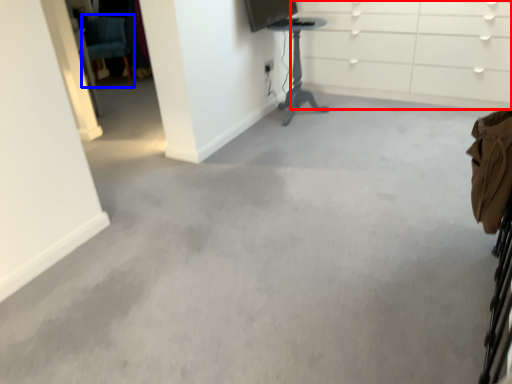
Question: Which object appears farthest to the camera in this image, dresser (highlighted by a red box) or swivel chair (highlighted by a blue box)?

Choices:
 (A) dresser
 (B) swivel chair

Answer: (B)